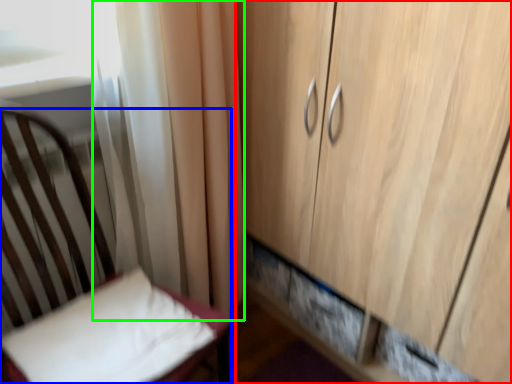
Question: Estimate the real-world distances between objects in this image. Which object is farther from cupboard (highlighted by a red box), furniture (highlighted by a blue box) or curtain (highlighted by a green box)?

Choices:
 (A) furniture
 (B) curtain

Answer: (A)